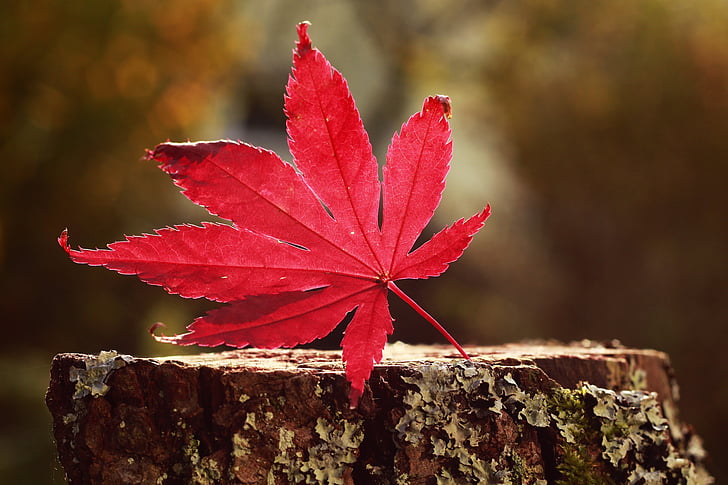
This screenshot has width=728, height=485. I want to click on light, so click(264, 101), click(277, 34), click(333, 32), click(387, 112), click(470, 181), click(175, 314), click(186, 213), click(266, 356), click(309, 358), click(397, 357).